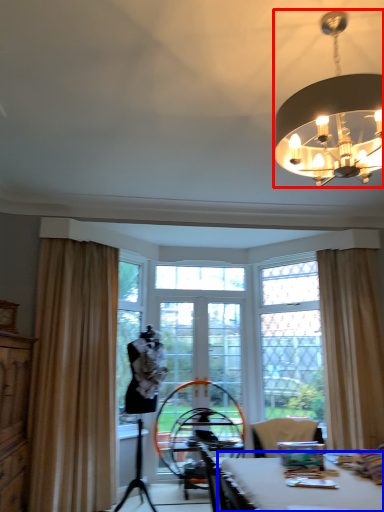
Question: Among these objects, which one is farthest to the camera, lamp (highlighted by a red box) or table (highlighted by a blue box)?

Choices:
 (A) lamp
 (B) table

Answer: (A)